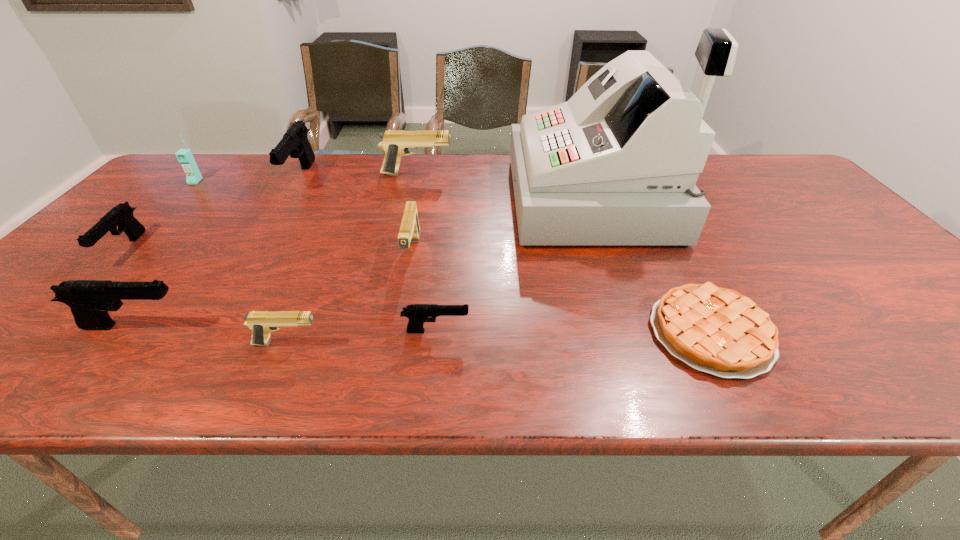
Find the location of `cellular telephone at the left edge`. cellular telephone at the left edge is located at coordinates (193, 176).

Where is `pistol at the left edge`? pistol at the left edge is located at coordinates [x=121, y=215].

This screenshot has width=960, height=540. I want to click on object that is positioned at the far left corner, so click(193, 176).

In the image, there is a desktop. Identify the location of vacant space at the far edge. (414, 164).

Image resolution: width=960 pixels, height=540 pixels. In the image, there is a desktop. Find the location of `free space at the near edge`. free space at the near edge is located at coordinates (901, 372).

The image size is (960, 540). Identify the location of free point at the left edge. (37, 296).

Locate an element on the screen. Image resolution: width=960 pixels, height=540 pixels. vacant space at the right edge is located at coordinates (900, 343).

Where is `empty space between the cellular telephone and the smallest black pistol`? The height and width of the screenshot is (540, 960). empty space between the cellular telephone and the smallest black pistol is located at coordinates (316, 256).

Locate an element on the screen. This screenshot has width=960, height=540. free space between the rightmost black pistol and the shortest object is located at coordinates (573, 332).

In order to click on vacant area between the tallest object and the smallest black pistol in this screenshot , I will do `click(515, 265)`.